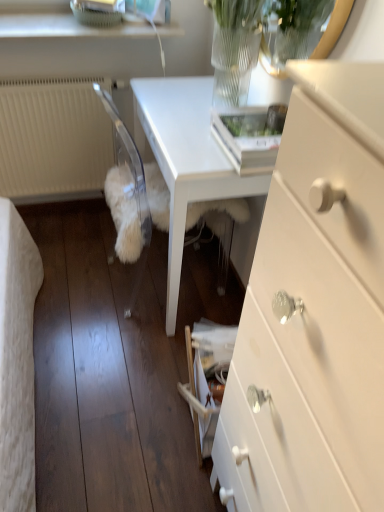
I want to click on vacant area to the left of white glossy table at center, so click(x=77, y=271).